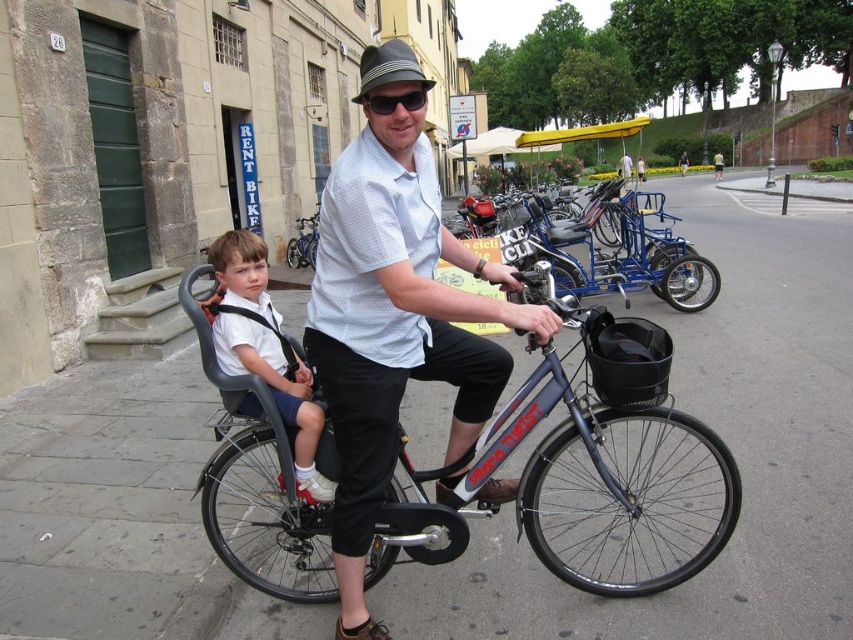
Is white textured shirt at center positioned behind metallic silver bicycle at center?

That is False.

Between white textured shirt at center and metallic silver bicycle at center, which one appears on the left side from the viewer's perspective?

Positioned to the left is metallic silver bicycle at center.

Where is `white textured shirt at center`? This screenshot has width=853, height=640. white textured shirt at center is located at coordinates (393, 310).

Where is `white textured shirt at center`? This screenshot has width=853, height=640. white textured shirt at center is located at coordinates (393, 310).

Can you confirm if silver metallic bicycle at center is taller than metallic silver bicycle at center?

Yes, silver metallic bicycle at center is taller than metallic silver bicycle at center.

Which is in front, point (491, 477) or point (306, 257)?

Point (491, 477) is more forward.

The width and height of the screenshot is (853, 640). Find the location of `silver metallic bicycle at center`. silver metallic bicycle at center is located at coordinates (577, 468).

Can you confirm if silver metallic bicycle at center is positioned to the left of white fabric shirt at left?

In fact, silver metallic bicycle at center is to the right of white fabric shirt at left.

Looking at this image, who is shorter, silver metallic bicycle at center or white fabric shirt at left?

Standing shorter between the two is white fabric shirt at left.

Is point (279, 522) positioned before point (271, 339)?

That is False.

The width and height of the screenshot is (853, 640). I want to click on silver metallic bicycle at center, so click(x=577, y=468).